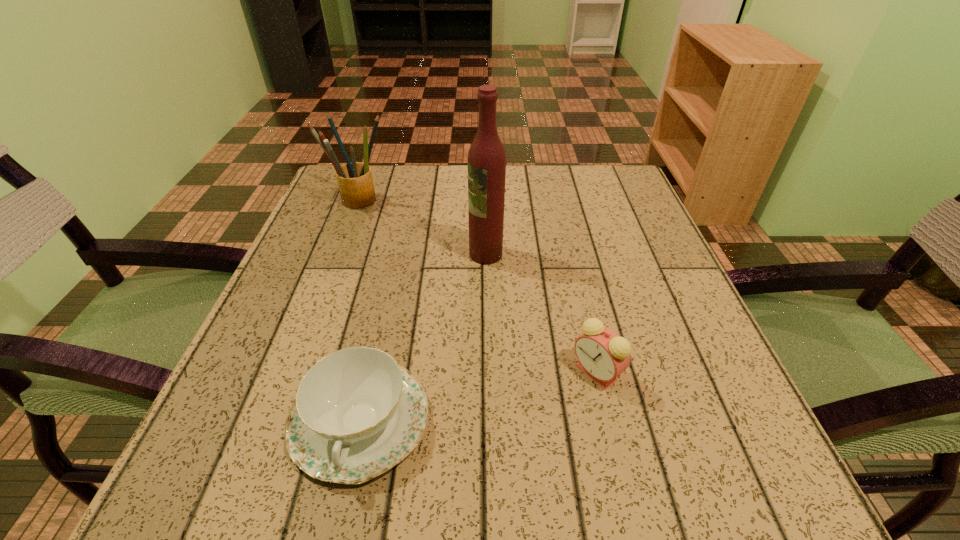
Locate an element on the screen. This screenshot has width=960, height=540. empty location between the tallest object and the farthest object is located at coordinates (422, 227).

Locate an element on the screen. Image resolution: width=960 pixels, height=540 pixels. vacant space that's between the liquor and the chinaware is located at coordinates (423, 337).

Locate an element on the screen. vacant region between the second tallest object and the chinaware is located at coordinates (359, 310).

Where is `unoccupied position between the tallest object and the pencil box`? This screenshot has height=540, width=960. unoccupied position between the tallest object and the pencil box is located at coordinates [422, 227].

Locate an element on the screen. The image size is (960, 540). vacant space in between the pencil box and the liquor is located at coordinates (422, 227).

At what (x,y) coordinates should I click in order to perform the action: click on unoccupied area between the third tallest object and the second tallest object. Please return your answer as a coordinate pair (x, y). Looking at the image, I should click on (477, 286).

Locate an element on the screen. vacant area that lies between the chinaware and the rightmost object is located at coordinates tap(478, 396).

Identify which object is located as the second nearest to the tallest object. Please provide its 2D coordinates. Your answer should be formatted as a tuple, i.e. [(x, y)], where the tuple contains the x and y coordinates of a point satisfying the conditions above.

[(603, 355)]

You are a GUI agent. You are given a task and a screenshot of the screen. Output one action in this format:
    pyautogui.click(x=<x>, y=<y>)
    Task: Click on the object that is the nearest to the chinaware
    The image size is (960, 540).
    Given the screenshot: What is the action you would take?
    pyautogui.click(x=603, y=355)

Where is `vacant space that satisfies the following two spatial constraints: 1. on the face of the second shortest object; 2. on the handle side of the chinaware`? The height and width of the screenshot is (540, 960). vacant space that satisfies the following two spatial constraints: 1. on the face of the second shortest object; 2. on the handle side of the chinaware is located at coordinates (608, 420).